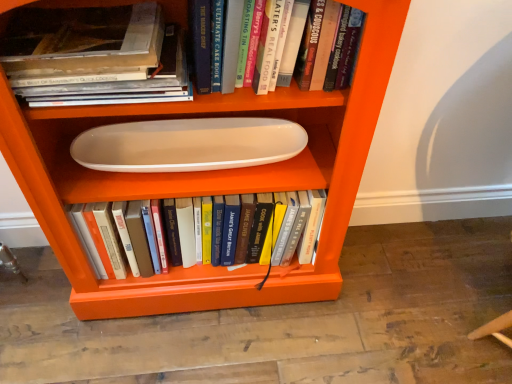
This screenshot has height=384, width=512. What are the coordinates of `unoccupied region to the right of white glossy oval tray at center` in the screenshot? It's located at (384, 310).